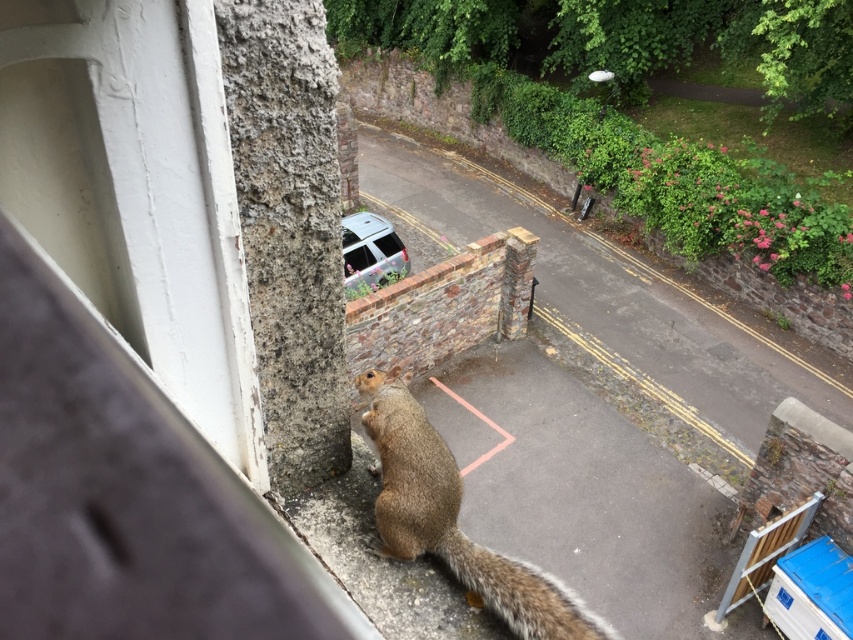
Question: Which point is closer to the camera?

Choices:
 (A) (386, 545)
 (B) (451, 548)

Answer: (A)

Question: Is brown furry squirrel at lower center above fuzzy brown tail at lower center?

Choices:
 (A) yes
 (B) no

Answer: (A)

Question: Is brown furry squirrel at lower center bigger than fuzzy brown tail at lower center?

Choices:
 (A) yes
 (B) no

Answer: (A)

Question: Among these points, which one is nearest to the camera?

Choices:
 (A) (583, 627)
 (B) (433, 532)

Answer: (A)

Question: Can you confirm if brown furry squirrel at lower center is bigger than fuzzy brown tail at lower center?

Choices:
 (A) no
 (B) yes

Answer: (B)